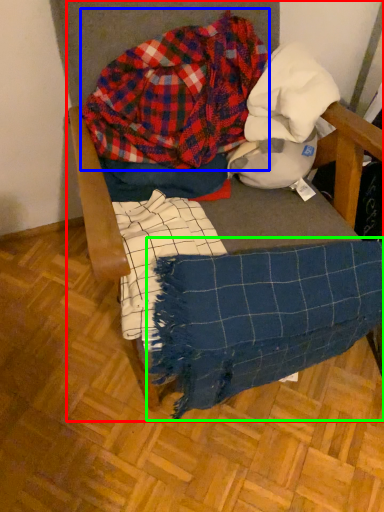
Question: Which object is the closest to the furniture (highlighted by a red box)? Choose among these: flannel (highlighted by a blue box) or blanket (highlighted by a green box).

Choices:
 (A) flannel
 (B) blanket

Answer: (A)